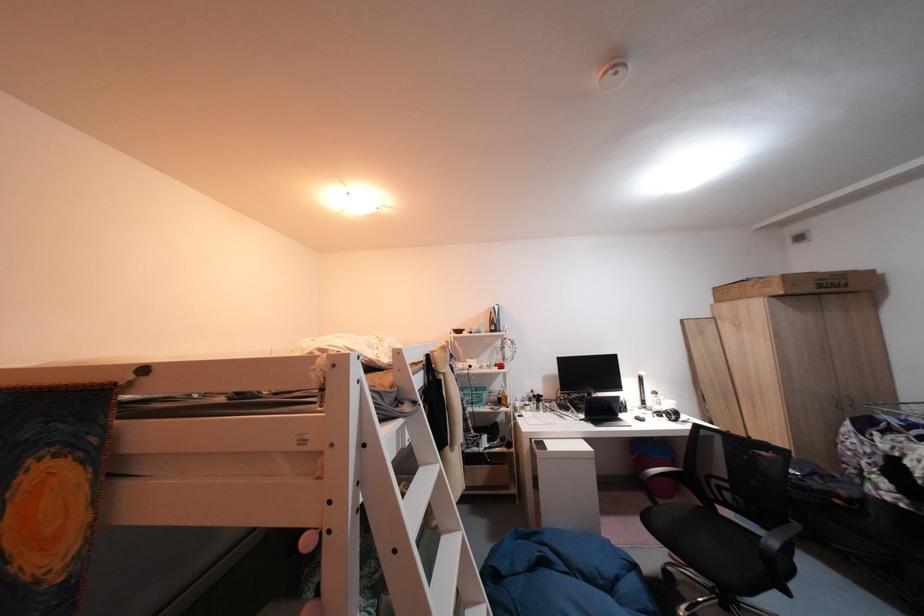
Find where to open the black laptop computer. Please return your answer as a coordinate pair (x, y).

(589, 374)